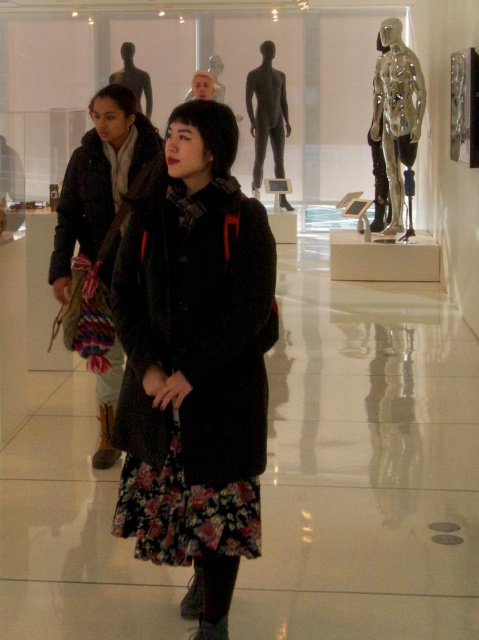
You are an art curator arranging items in the gallery. You have a matte black coat at center and a matte black mannequin at upper center. Which object is positioned to the right side of the other?

The matte black coat at center is to the right of the matte black mannequin at upper center.

You are an art curator standing in the gallery and want to place a new sculpture between the floral skirt at center and the matte black mannequin at center. Since both are at the center, how should you position the sculpture so it is equidistant from both?

The floral skirt at center is closer to the viewer than the matte black mannequin at center. To position the sculpture equidistant from both, place it halfway between them along the line connecting their positions, closer to the floral skirt to account for the distance difference.